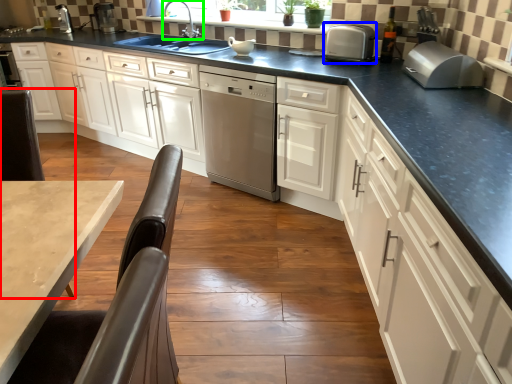
Question: Estimate the real-world distances between objects in this image. Which object is closer to chair (highlighted by a red box), kitchen appliance (highlighted by a blue box) or tap (highlighted by a green box)?

Choices:
 (A) kitchen appliance
 (B) tap

Answer: (A)